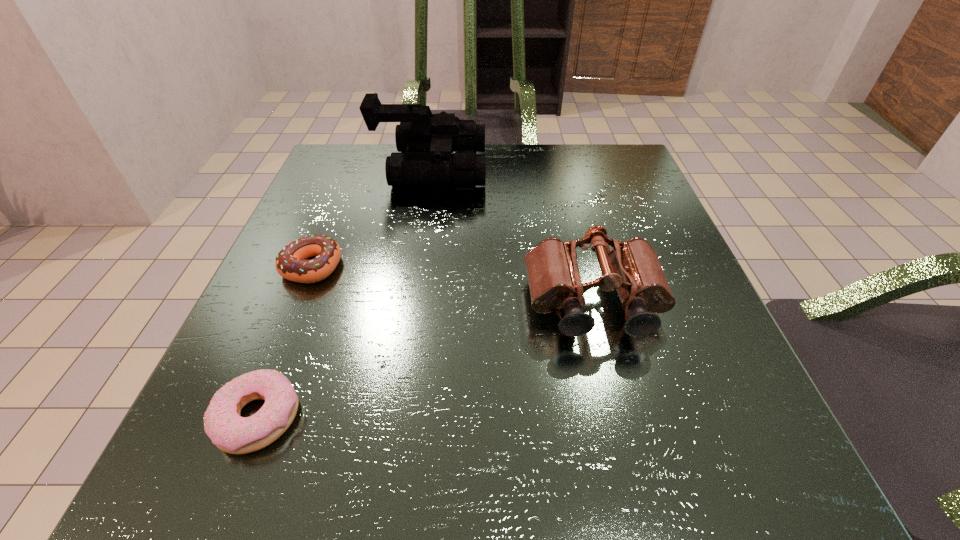
The image size is (960, 540). Find the location of `blank area located 0.140m on the back of the shortest object`. blank area located 0.140m on the back of the shortest object is located at coordinates (301, 306).

At what (x,y) coordinates should I click in order to perform the action: click on object at the far edge. Please return your answer as a coordinate pair (x, y). Image resolution: width=960 pixels, height=540 pixels. Looking at the image, I should click on (425, 142).

The height and width of the screenshot is (540, 960). I want to click on object present at the near edge, so click(231, 433).

At what (x,y) coordinates should I click in order to perform the action: click on binoculars positioned at the left edge. Please return your answer as a coordinate pair (x, y). Image resolution: width=960 pixels, height=540 pixels. Looking at the image, I should click on (425, 142).

The image size is (960, 540). Identify the location of object located in the right edge section of the desktop. (632, 268).

Find the location of a particular element. The image size is (960, 540). object present at the far left corner is located at coordinates (425, 142).

The height and width of the screenshot is (540, 960). I want to click on object that is positioned at the near left corner, so click(x=231, y=433).

In the image, there is a desktop. Identify the location of vacant space at the far edge. This screenshot has width=960, height=540. (488, 147).

Where is `vacant space at the near edge of the desktop`? This screenshot has height=540, width=960. vacant space at the near edge of the desktop is located at coordinates [627, 485].

Find the location of a particular element. free region at the left edge of the desktop is located at coordinates (245, 367).